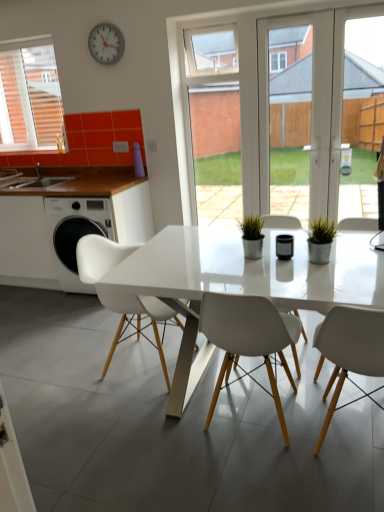
Identify the location of vacant area located to the right-hand side of green matte plant at right. (349, 255).